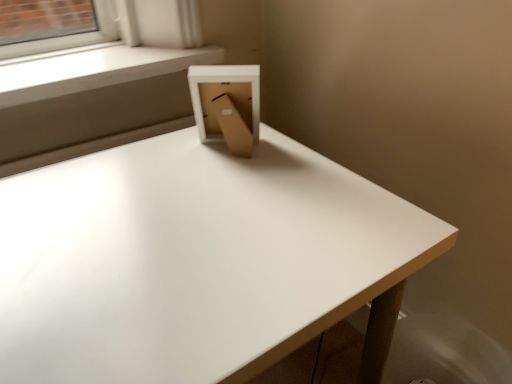
This screenshot has width=512, height=384. Find the location of `blank space to the left of cardboard box at center`. blank space to the left of cardboard box at center is located at coordinates [151, 163].